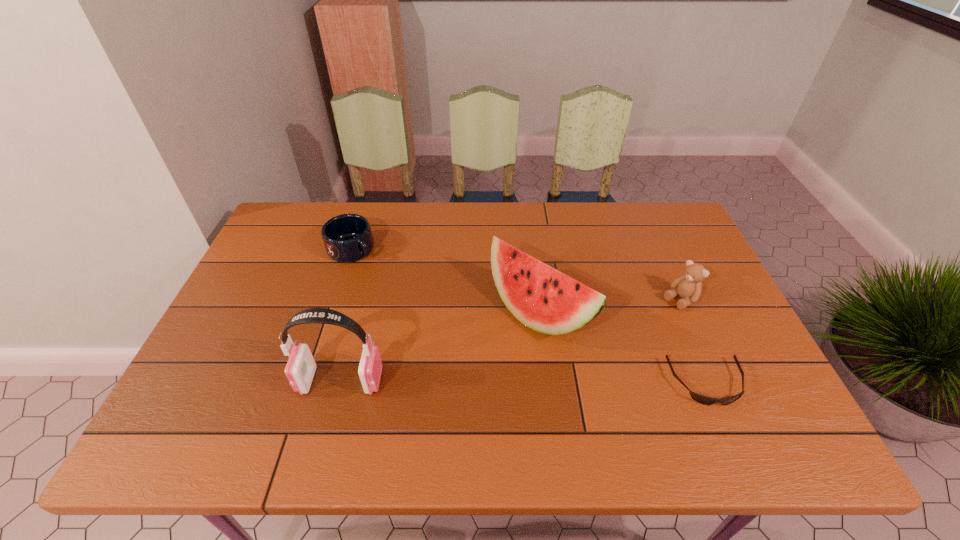
At what (x,y) coordinates should I click in order to perform the action: click on vacant region located on the face of the third shortest object. Please return your answer as a coordinate pair (x, y). Looking at the image, I should click on (566, 380).

What are the coordinates of `vacant space located 0.230m on the face of the third shortest object` in the screenshot? It's located at (612, 348).

Where is `free region located on the face of the third shortest object`? free region located on the face of the third shortest object is located at coordinates click(x=587, y=366).

The height and width of the screenshot is (540, 960). Identify the location of vacant area situated with the handle on the side of the mug. (404, 292).

What are the coordinates of `free space located 0.210m with the handle on the side of the mug` in the screenshot? It's located at (408, 295).

This screenshot has height=540, width=960. What are the coordinates of `free space located with the handle on the side of the mug` in the screenshot? It's located at (422, 306).

Where is `free spot located on the outer rind of the watermelon`? The height and width of the screenshot is (540, 960). free spot located on the outer rind of the watermelon is located at coordinates (497, 357).

In order to click on free space located on the outer rind of the watermelon in this screenshot , I will do `click(460, 395)`.

This screenshot has height=540, width=960. Identify the location of free point located on the outer rind of the watermelon. (463, 392).

What are the coordinates of `object present at the far edge` in the screenshot? It's located at 347,238.